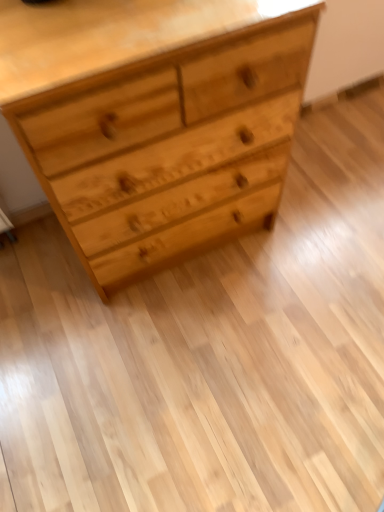
Identify the location of vacant space to the right of natural wood chest of drawers at upper center. The image size is (384, 512). (322, 223).